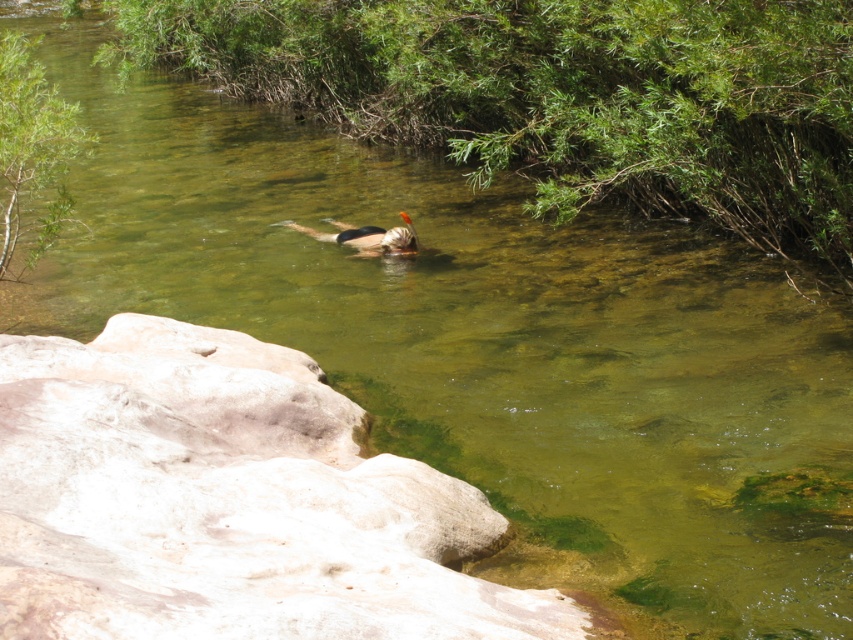
You are a photographer planning to capture the white rock at lower left and the green leafy bush at upper left in the same frame. Considering their sizes, which object should you move closer to in order to make them appear similar in size in your photo?

To make the white rock at lower left and the green leafy bush at upper left appear similar in size in the photo, you should move closer to the white rock at lower left since it is smaller than the green leafy bush at upper left.

You are a photographer trying to capture the smooth brown man at center and the green leafy bush at upper center in the same frame. Based on their positions, which object is higher up in the image?

The green leafy bush at upper center is higher up in the image than the smooth brown man at center.